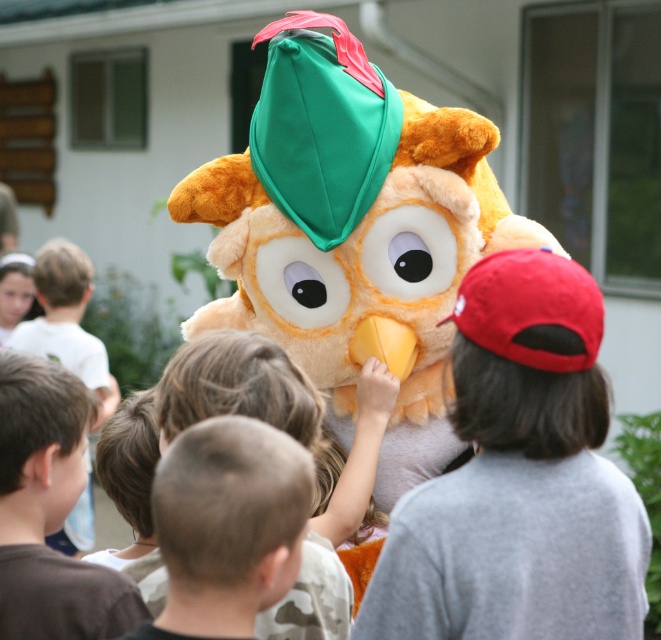
Question: Considering the relative positions of fluffy orange owl at center and light brown hair at upper left in the image provided, where is fluffy orange owl at center located with respect to light brown hair at upper left?

Choices:
 (A) left
 (B) right

Answer: (B)

Question: Which object is the closest to the light brown hair at upper left?

Choices:
 (A) fluffy orange owl at center
 (B) red fabric cap at center

Answer: (A)

Question: Can you confirm if fluffy orange owl at center is positioned below light brown hair at upper left?

Choices:
 (A) no
 (B) yes

Answer: (A)

Question: Which object is farther from the camera taking this photo?

Choices:
 (A) fluffy orange owl at center
 (B) light brown hair at upper left
 (C) red fabric cap at center

Answer: (B)

Question: Is fluffy orange owl at center positioned at the back of red fabric cap at center?

Choices:
 (A) no
 (B) yes

Answer: (B)

Question: Estimate the real-world distances between objects in this image. Which object is farther from the light brown hair at upper left?

Choices:
 (A) red fabric cap at center
 (B) fluffy orange owl at center

Answer: (A)